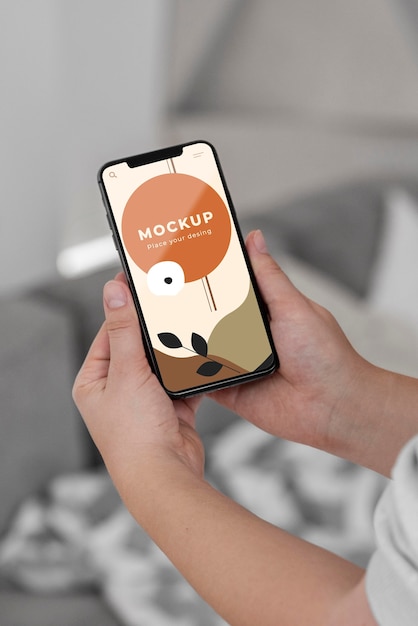
This screenshot has height=626, width=418. Identify the location of screen. (222, 309).